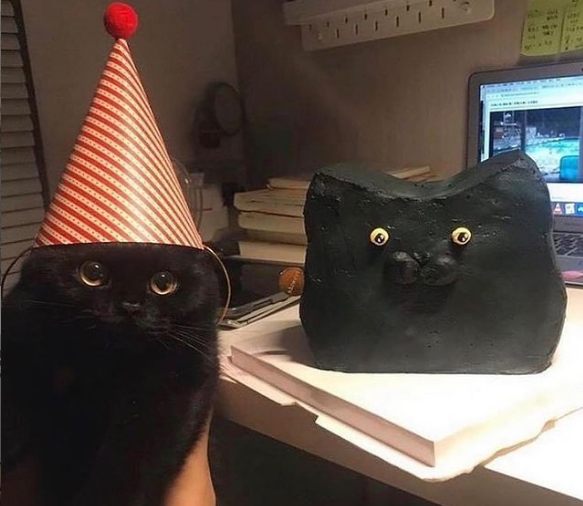
This screenshot has height=506, width=583. What are the coordinates of `cat statue` in the screenshot? It's located at (427, 338).